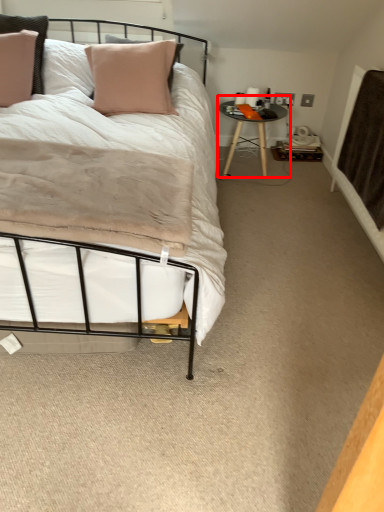
Question: From the image's perspective, considering the relative positions of table (annotated by the red box) and blanket in the image provided, where is table (annotated by the red box) located with respect to the staircase?

Choices:
 (A) below
 (B) above

Answer: (B)